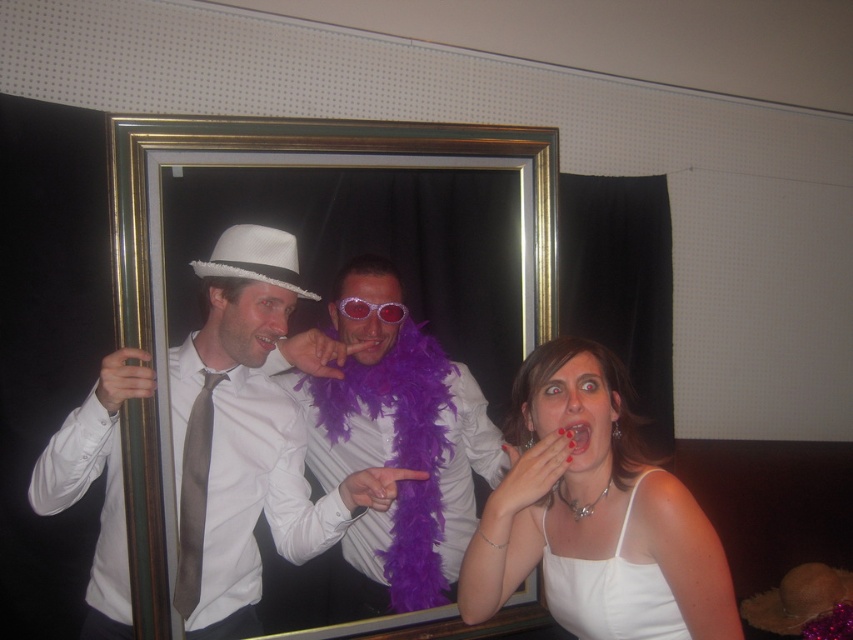
Does gold/glossy picture frame at center appear under white fabric tank top at lower right?

Result: Actually, gold/glossy picture frame at center is above white fabric tank top at lower right.

Does gold/glossy picture frame at center have a greater height compared to white fabric tank top at lower right?

Yes.

Who is more forward, (409, 152) or (585, 483)?

Positioned in front is point (585, 483).

The image size is (853, 640). What are the coordinates of `gold/glossy picture frame at center` in the screenshot? It's located at (317, 164).

How distant is matte white hat at center from white fabric tank top at lower right?

matte white hat at center is 17.36 inches from white fabric tank top at lower right.

Is matte white hat at center shorter than white fabric tank top at lower right?

No, matte white hat at center is not shorter than white fabric tank top at lower right.

What do you see at coordinates (247, 440) in the screenshot? This screenshot has height=640, width=853. I see `matte white hat at center` at bounding box center [247, 440].

The width and height of the screenshot is (853, 640). I want to click on matte white hat at center, so click(247, 440).

Is satin gray tie at left smaller than translucent plastic sunglasses at center?

No, satin gray tie at left is not smaller than translucent plastic sunglasses at center.

Is satin gray tie at left positioned before translucent plastic sunglasses at center?

Yes, satin gray tie at left is closer to the viewer.

Image resolution: width=853 pixels, height=640 pixels. In order to click on satin gray tie at left in this screenshot , I will do `click(194, 497)`.